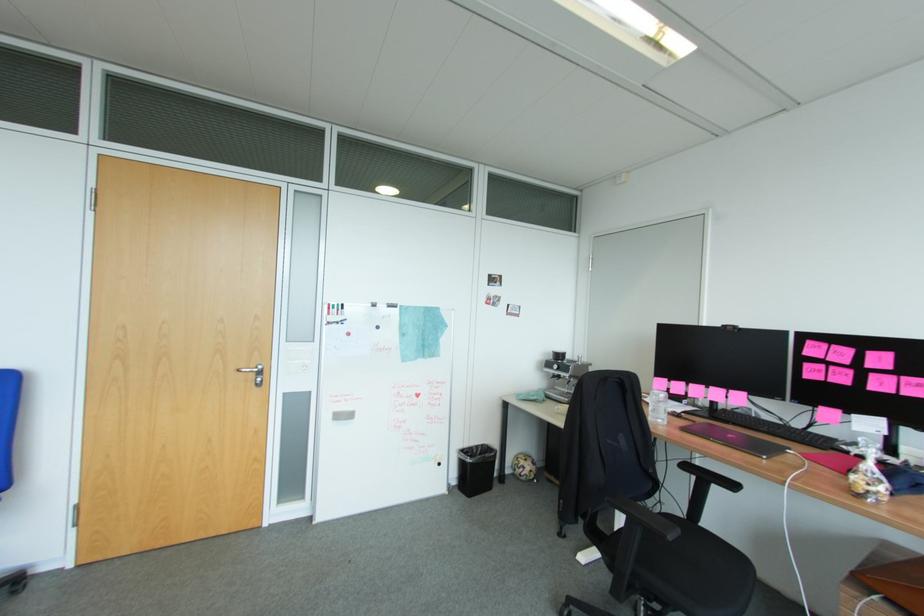
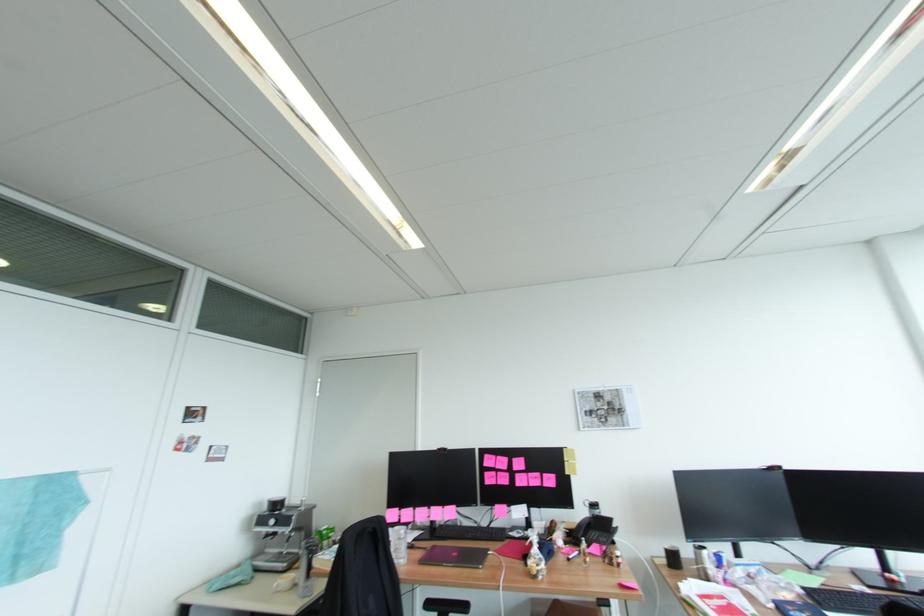
In the second image, find the point that corresponds to point (884, 360) in the first image.

(524, 463)